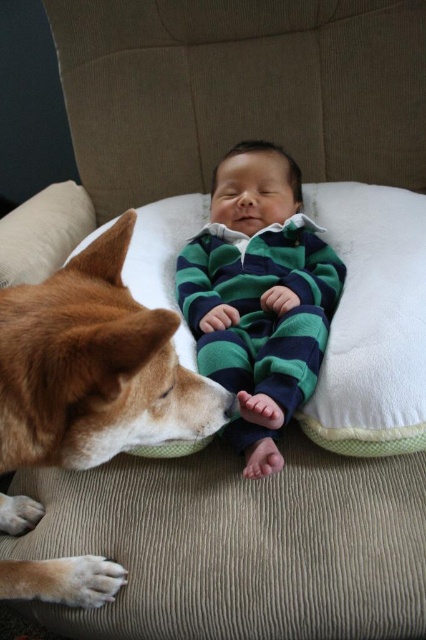
Can you confirm if brown fur dog at lower left is thinner than green striped pajamas at center?

Yes.

What do you see at coordinates (94, 365) in the screenshot?
I see `brown fur dog at lower left` at bounding box center [94, 365].

Is point (20, 445) positioned in front of point (253, 180)?

Yes, it is in front of point (253, 180).

I want to click on brown fur dog at lower left, so click(x=94, y=365).